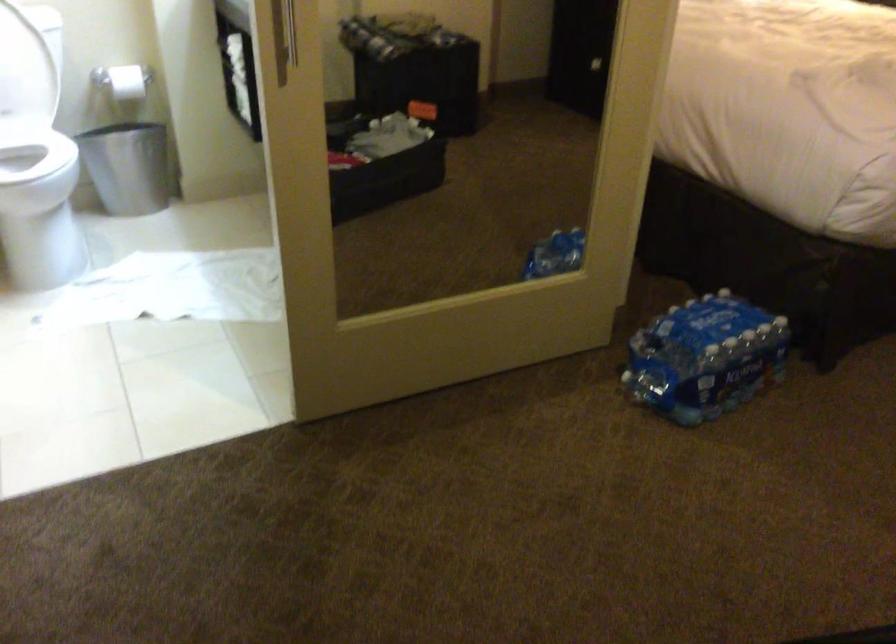
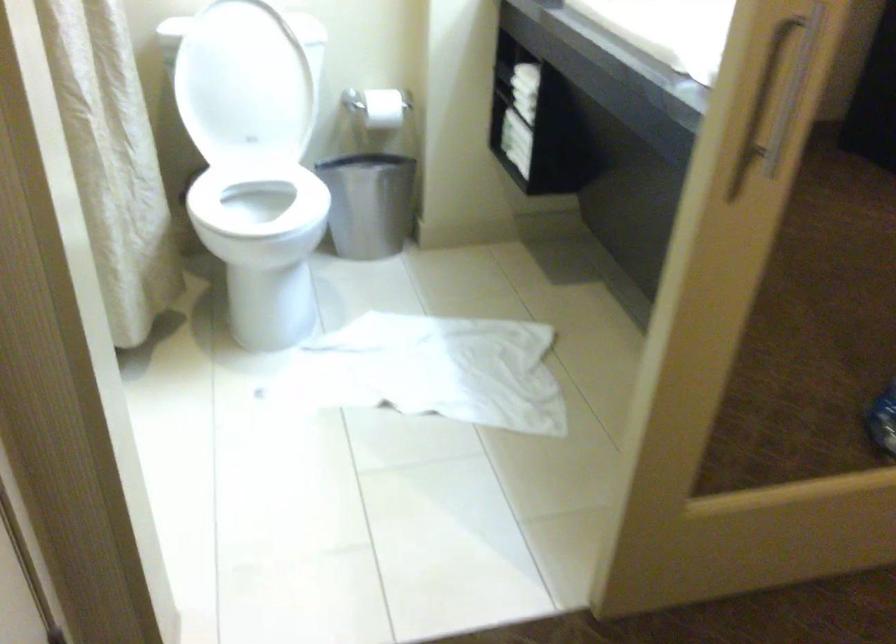
The point at (x=438, y=287) is marked in the first image. Where is the corresponding point in the second image?

(754, 422)